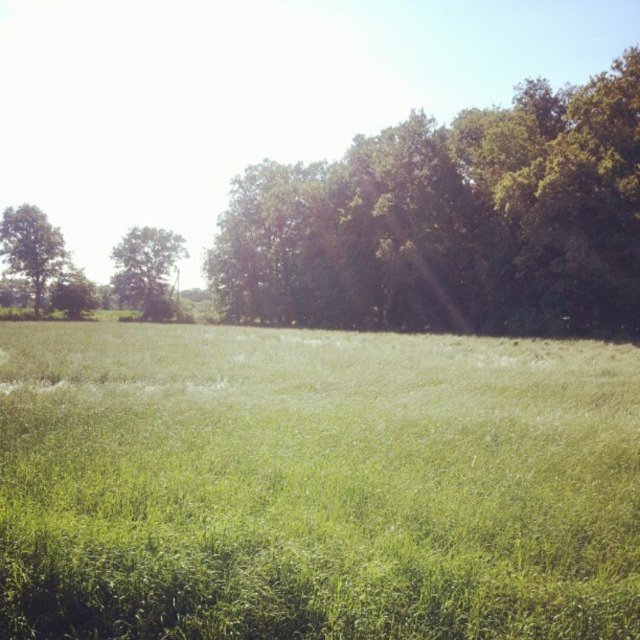
Question: Based on their relative distances, which object is nearer to the green grassy pasture at center?

Choices:
 (A) green leafy tree at center-left
 (B) green leafy tree at upper right

Answer: (B)

Question: Which point is closer to the camera taking this photo?

Choices:
 (A) (342, 305)
 (B) (24, 209)
 (C) (387, 424)

Answer: (C)

Question: Is green grassy pasture at center to the left of green leafy tree at left from the viewer's perspective?

Choices:
 (A) yes
 (B) no

Answer: (B)

Question: Does green grassy pasture at center appear on the right side of green leafy tree at upper right?

Choices:
 (A) yes
 (B) no

Answer: (B)

Question: Among these points, which one is farthest from the camera?

Choices:
 (A) (572, 305)
 (B) (52, 253)
 (C) (577, 548)
 (D) (120, 244)

Answer: (D)

Question: Is green leafy tree at upper right positioned at the back of green leafy tree at left?

Choices:
 (A) no
 (B) yes

Answer: (A)